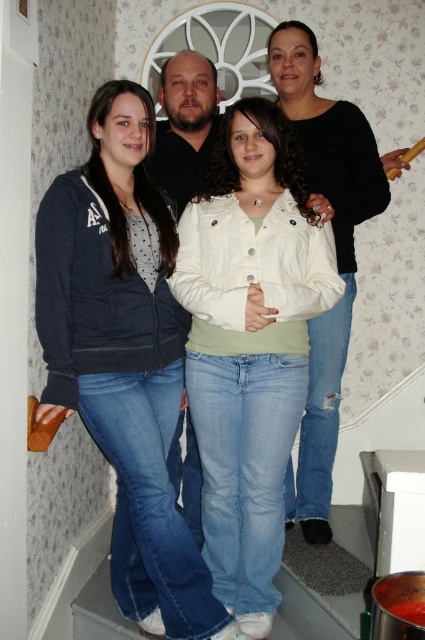
Does point (319, 236) lie in front of point (351, 138)?

Yes, point (319, 236) is in front of point (351, 138).

Image resolution: width=425 pixels, height=640 pixels. What do you see at coordinates (249, 342) in the screenshot?
I see `white matte jacket at center` at bounding box center [249, 342].

Identify the location of white matte jacket at center. (249, 342).

Does matte black jacket at center appear on the right side of white matte jacket at center?

In fact, matte black jacket at center is to the left of white matte jacket at center.

Can you confirm if matte black jacket at center is taller than white matte jacket at center?

Indeed, matte black jacket at center has a greater height compared to white matte jacket at center.

Which is behind, point (115, 212) or point (218, 180)?

Point (218, 180)

The height and width of the screenshot is (640, 425). In order to click on matte black jacket at center in this screenshot , I will do `click(124, 356)`.

Between matte black jacket at center and black matte jacket at upper center, which one is positioned lower?

matte black jacket at center

Which of these two, matte black jacket at center or black matte jacket at upper center, stands shorter?

matte black jacket at center is shorter.

I want to click on matte black jacket at center, so click(124, 356).